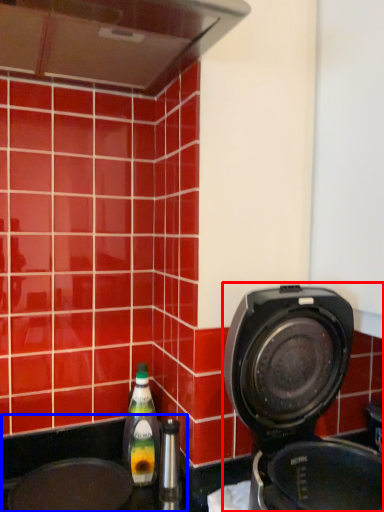
Question: Among these objects, which one is farthest to the camera, home appliance (highlighted by a red box) or sink (highlighted by a blue box)?

Choices:
 (A) home appliance
 (B) sink

Answer: (B)